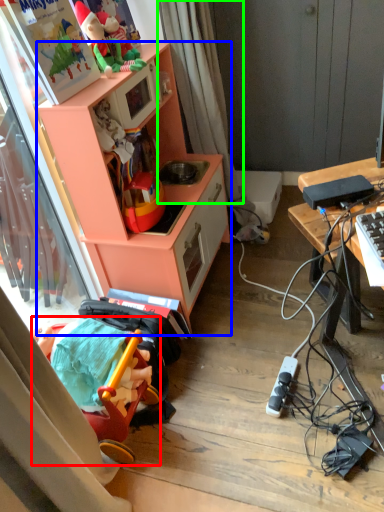
Question: Estimate the real-world distances between objects in this image. Which object is closer to toy (highlighted by a red box), cabinetry (highlighted by a blue box) or curtain (highlighted by a green box)?

Choices:
 (A) cabinetry
 (B) curtain

Answer: (A)